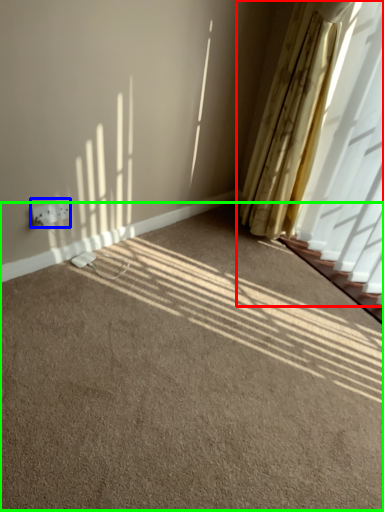
Question: Considering the real-world distances, which object is closest to curtain (highlighted by a red box)? electric outlet (highlighted by a blue box) or plain (highlighted by a green box).

Choices:
 (A) electric outlet
 (B) plain

Answer: (B)